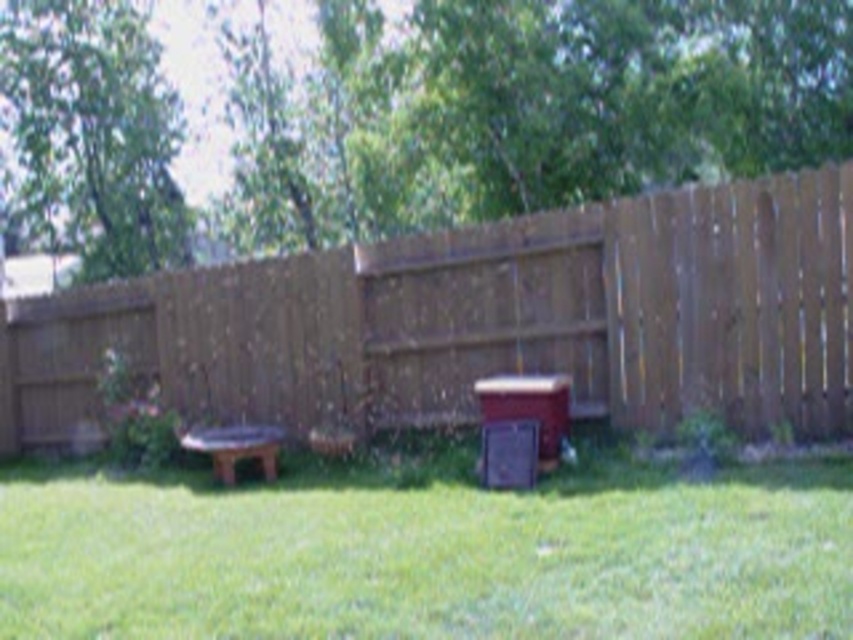
Consider the image. You are planning to set up a small outdoor dining area in your backyard. You have a brown wooden picnic table at center and a brown wooden fence at center. Which object should you move to create more space for the dining area?

The brown wooden fence at center is larger in size compared to the brown wooden picnic table at center, so moving the picnic table would free up more space for the dining area.

You are planning to set up a garden in the backyard and want to place a tall plant stand that requires at least 2 meters of clearance. Based on the scene, which object between the brown wooden fence at center and the brown wooden picnic table at center would allow enough vertical space for the plant stand?

The brown wooden fence at center is much taller than the brown wooden picnic table at center, so the brown wooden fence at center would provide the necessary vertical clearance for the plant stand.